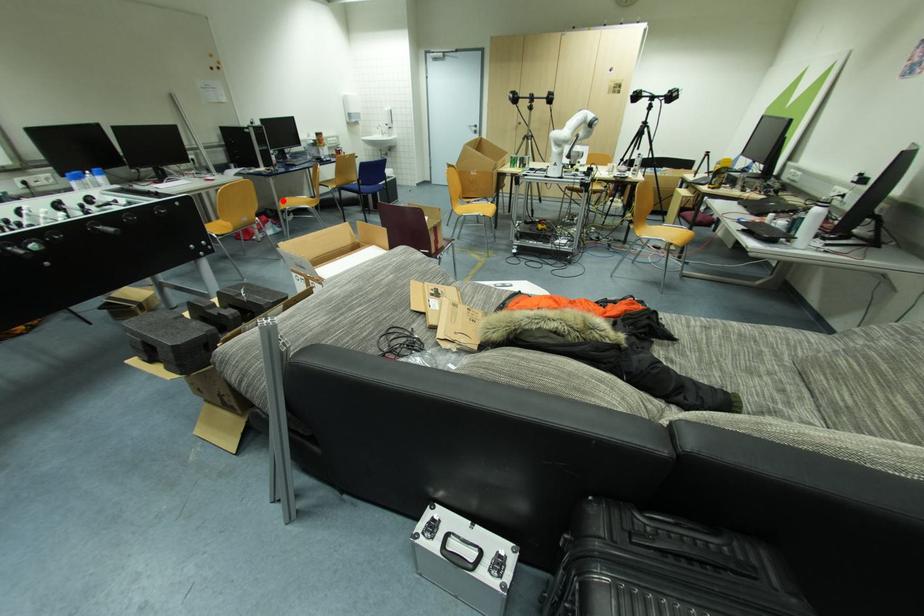
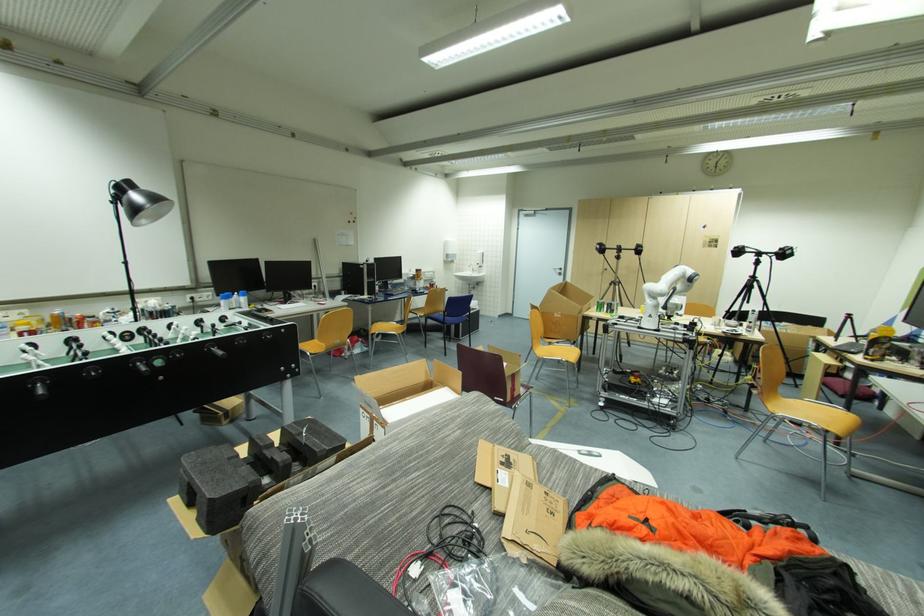
In the second image, find the point that corresponds to the highlighted location in the first image.

(377, 323)